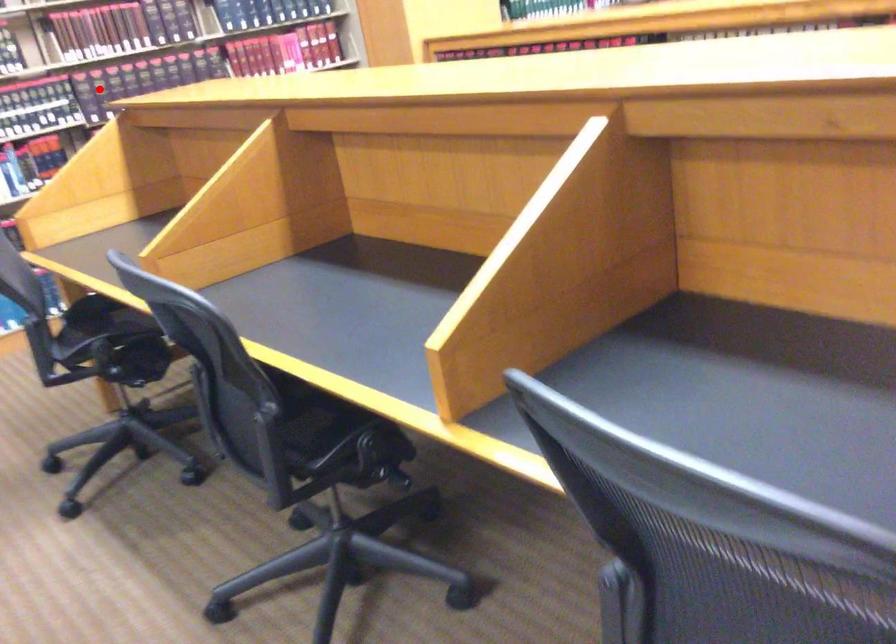
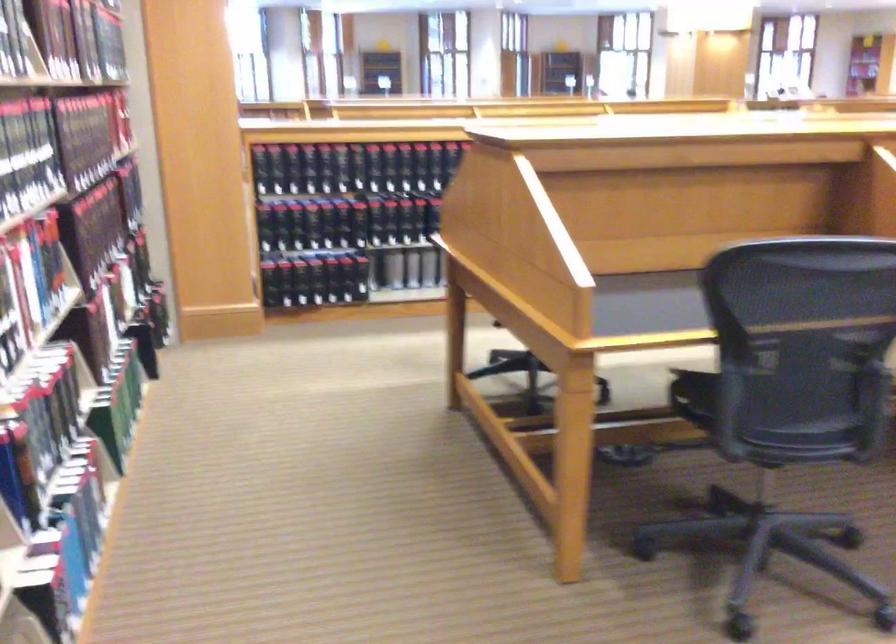
Question: I am providing you with two images of the same scene from different viewpoints. A red point is marked on the first image. Can you still see the location of the red point in image 2?

Choices:
 (A) Yes
 (B) No

Answer: (B)